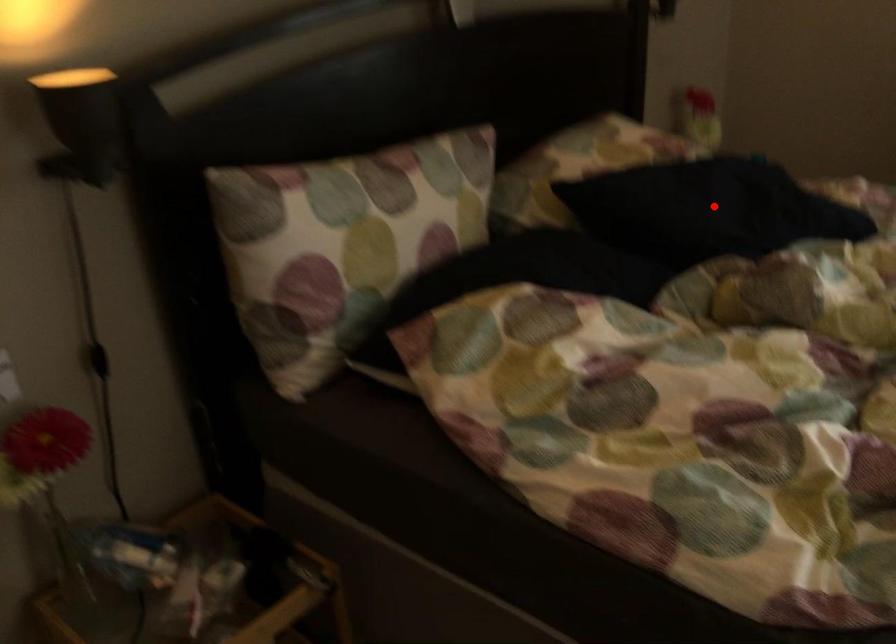
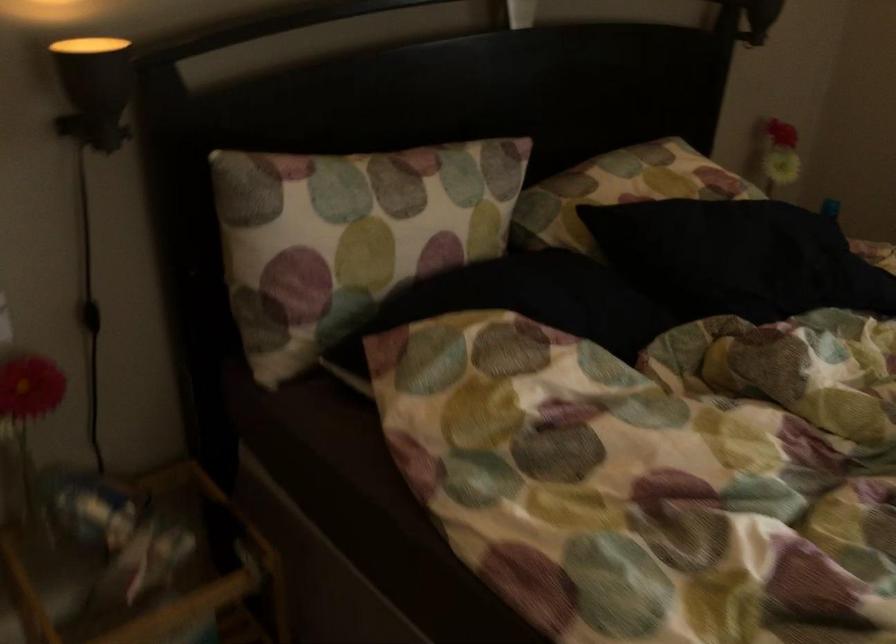
The point at the highlighted location is marked in the first image. Where is the corresponding point in the second image?

(737, 258)